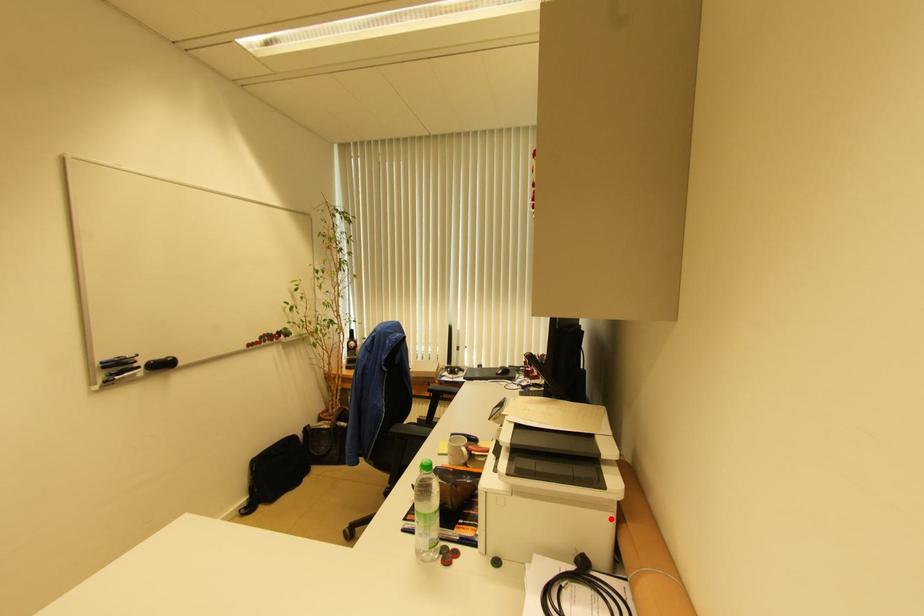
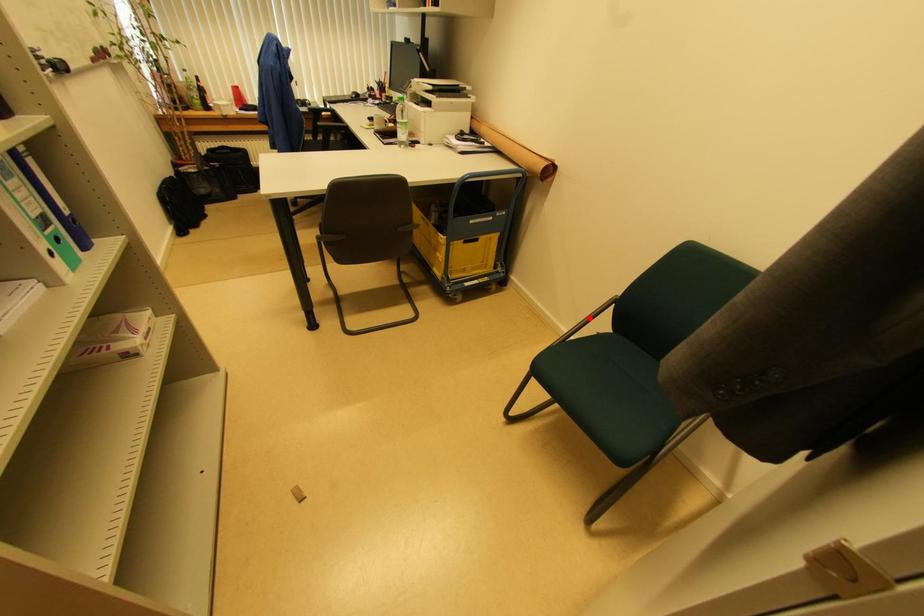
I am providing you with two images of the same scene from different viewpoints. A red point is marked on the first image and another point is marked on the second image. Is the marked point in image1 the same physical position as the marked point in image2?

No